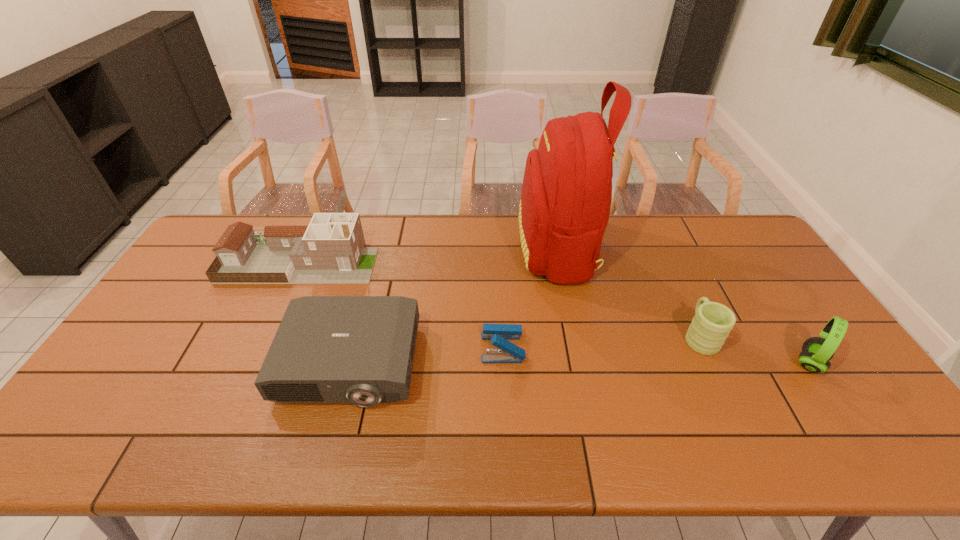
I want to click on free space located 0.050m on the front-facing side of the backpack, so click(x=503, y=248).

What are the coordinates of `free region located at the main entrance of the dollhouse` in the screenshot? It's located at (402, 262).

In order to click on vacant region located on the left of the rightmost object in this screenshot , I will do `click(761, 363)`.

At what (x,y) coordinates should I click in order to perform the action: click on vacant space located 0.280m on the side of the mug with the handle. Please return your answer as a coordinate pair (x, y). Looking at the image, I should click on (662, 255).

The width and height of the screenshot is (960, 540). In order to click on free space located 0.290m on the side of the mug with the handle in this screenshot , I will do `click(661, 254)`.

The image size is (960, 540). In order to click on vacant space located 0.110m on the side of the mug with the handle in this screenshot , I will do coord(679,291).

Identify the location of blank space located on the front-facing side of the projector. (332, 430).

In order to click on vacant region located on the back of the shortest object in this screenshot , I will do `click(500, 288)`.

The width and height of the screenshot is (960, 540). Identify the location of backpack positioned at the far edge. (566, 196).

This screenshot has height=540, width=960. I want to click on dollhouse that is at the far edge, so click(x=330, y=250).